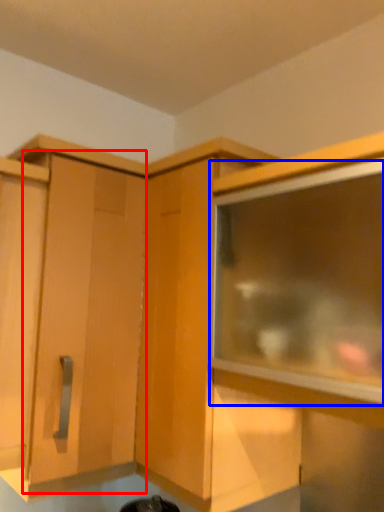
Question: Which of the following is the farthest to the observer, cabinetry (highlighted by a red box) or window (highlighted by a blue box)?

Choices:
 (A) cabinetry
 (B) window

Answer: (A)